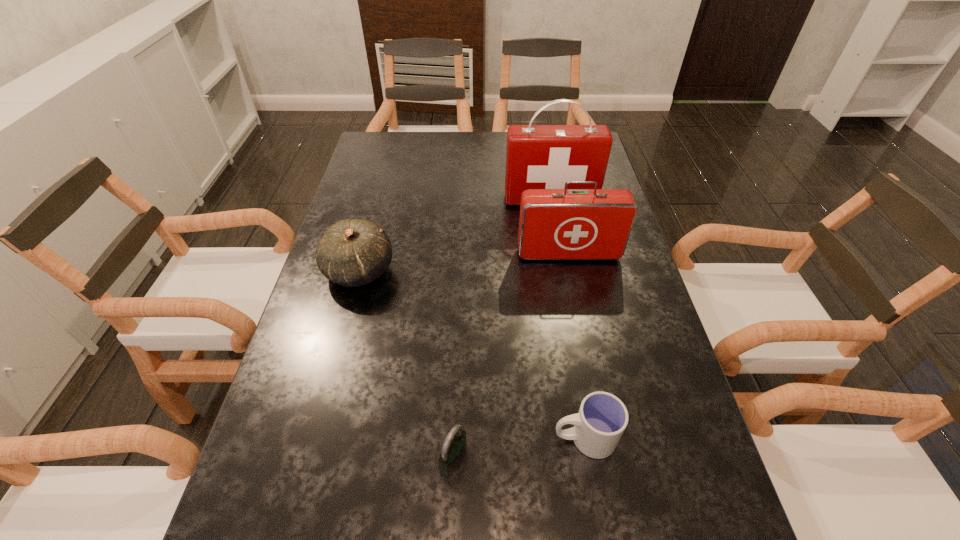
The height and width of the screenshot is (540, 960). Identify the location of free spot between the padlock and the leftmost object. (407, 366).

Find the location of `object that stands as the fourth closest to the gourd`. object that stands as the fourth closest to the gourd is located at coordinates (602, 418).

Point out which object is positioned as the nearest to the farther first-aid kit. Please provide its 2D coordinates. Your answer should be formatted as a tuple, i.e. [(x, y)], where the tuple contains the x and y coordinates of a point satisfying the conditions above.

[(555, 224)]

Where is `vacant area in the image that satisfies the following two spatial constraints: 1. on the front face of the farthest object; 2. with the handle on the side of the cup`? The width and height of the screenshot is (960, 540). vacant area in the image that satisfies the following two spatial constraints: 1. on the front face of the farthest object; 2. with the handle on the side of the cup is located at coordinates (595, 437).

Identify the location of free spot that satisfies the following two spatial constraints: 1. on the side of the second tallest object with the first aid cross symbol; 2. with the handle on the side of the cup. This screenshot has height=540, width=960. (606, 437).

This screenshot has height=540, width=960. In order to click on vacant space that satisfies the following two spatial constraints: 1. on the side of the shorter first-aid kit with the first aid cross symbol; 2. with the handle on the side of the cup in this screenshot , I will do `click(606, 437)`.